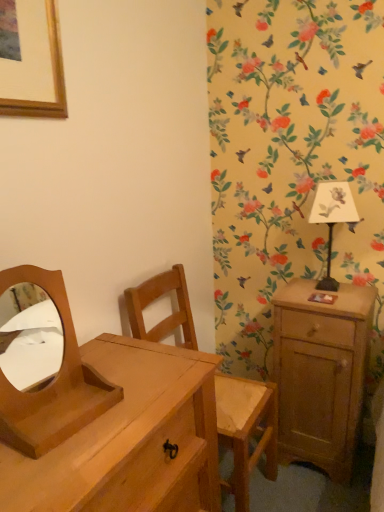
You are a GUI agent. You are given a task and a screenshot of the screen. Output one action in this format:
    pyautogui.click(x=<x>, y=<y>)
    Task: Click on the vacant space to the right of white paper lampshade at upper right
    The height and width of the screenshot is (512, 384).
    Given the screenshot: What is the action you would take?
    pyautogui.click(x=357, y=291)